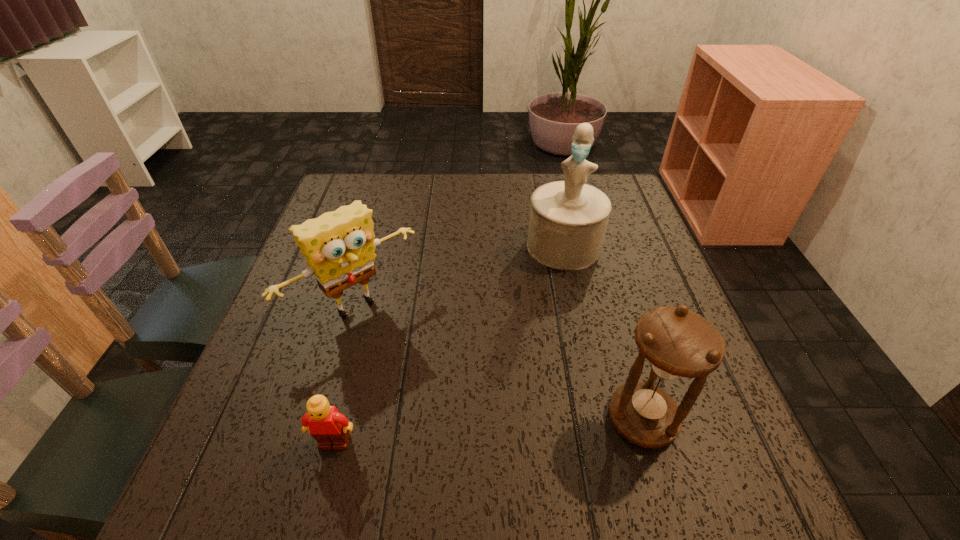
Where is `vacant point located between the third nearest object and the Lego`? vacant point located between the third nearest object and the Lego is located at coordinates (346, 374).

I want to click on unoccupied area between the Lego and the hourglass, so click(x=489, y=430).

Locate an element on the screen. This screenshot has width=960, height=540. free space between the shortest object and the second farthest object is located at coordinates (346, 374).

The image size is (960, 540). Identify the location of vacant area that lies between the farthest object and the Lego. (449, 344).

Where is `free area in between the sponge and the hourglass`? The width and height of the screenshot is (960, 540). free area in between the sponge and the hourglass is located at coordinates pos(499,362).

The image size is (960, 540). I want to click on free space between the hourglass and the shortest object, so click(x=489, y=430).

Identify which object is the third nearest to the Lego. Please provide its 2D coordinates. Your answer should be formatted as a tuple, i.e. [(x, y)], where the tuple contains the x and y coordinates of a point satisfying the conditions above.

[(568, 219)]

Select which object is the closest to the tallest object. Please provide its 2D coordinates. Your answer should be formatted as a tuple, i.e. [(x, y)], where the tuple contains the x and y coordinates of a point satisfying the conditions above.

[(339, 246)]